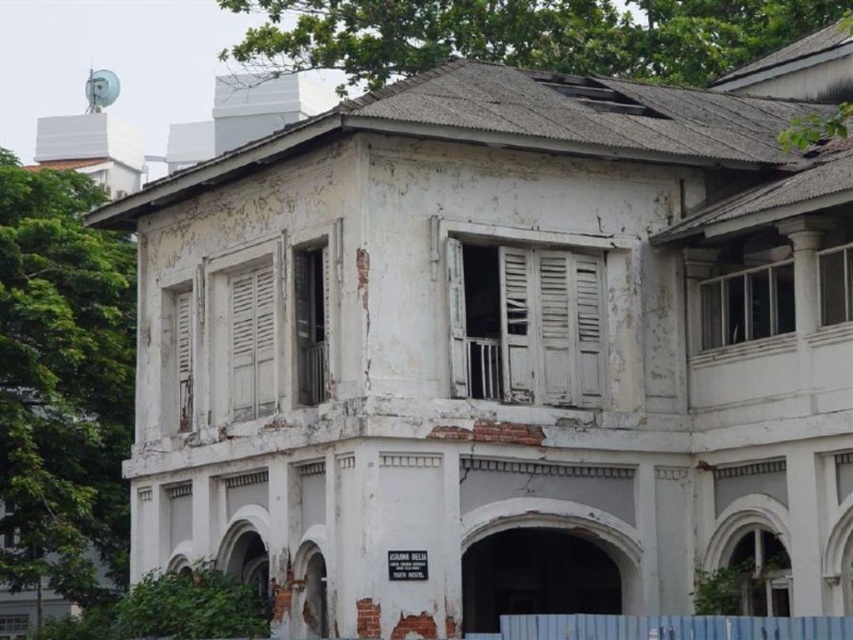
Question: Does white matte shutters at center have a larger size compared to white wooden shutter at left?

Choices:
 (A) yes
 (B) no

Answer: (B)

Question: Which point is closer to the camera?

Choices:
 (A) (537, 380)
 (B) (247, 308)

Answer: (A)

Question: Which of the following is the farthest from the observer?

Choices:
 (A) white matte shutters at center
 (B) white wooden shutter at left

Answer: (B)

Question: Where is white matte shutters at center located in relation to white wooden shutter at left in the image?

Choices:
 (A) above
 (B) below

Answer: (A)

Question: Does white matte shutters at center have a lesser width compared to white wooden shutter at left?

Choices:
 (A) yes
 (B) no

Answer: (B)

Question: Which object is closer to the camera taking this photo?

Choices:
 (A) white wooden shutter at left
 (B) white matte shutters at center

Answer: (B)